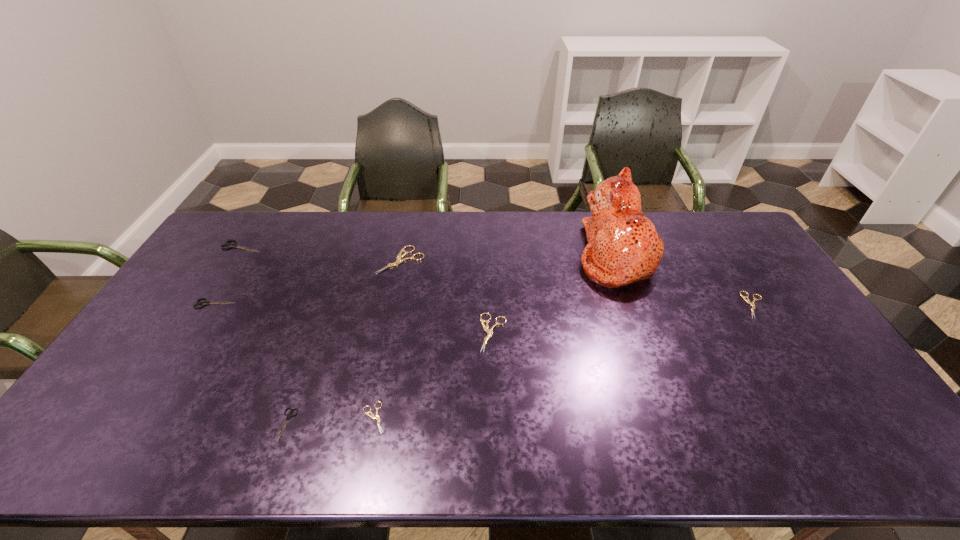
This screenshot has width=960, height=540. I want to click on free space at the near left corner of the desktop, so click(129, 430).

This screenshot has height=540, width=960. What are the coordinates of `free space at the far right corner of the desktop` in the screenshot? It's located at (746, 237).

Locate an element on the screen. The image size is (960, 540). vacant area between the second nearest black shears and the smallest beige shears is located at coordinates (295, 361).

Locate an element on the screen. free space between the tallest object and the fifth shears from right to left is located at coordinates (451, 340).

You are a GUI agent. You are given a task and a screenshot of the screen. Output one action in this format:
    pyautogui.click(x=<x>, y=<y>)
    Task: Click on the free space between the biggest beige shears and the second biggest beige shears
    
    Given the screenshot: What is the action you would take?
    pyautogui.click(x=447, y=296)

Find the location of a particular element. The image size is (960, 540). empty space between the third biggest beige shears and the second shears from right to left is located at coordinates (624, 319).

This screenshot has height=540, width=960. I want to click on vacant space that's between the smallest beige shears and the cat, so click(x=494, y=336).

Image resolution: width=960 pixels, height=540 pixels. Find the location of `vacant space that's between the smallest beige shears and the third object from right to left`. vacant space that's between the smallest beige shears and the third object from right to left is located at coordinates (434, 375).

Image resolution: width=960 pixels, height=540 pixels. What are the coordinates of `free space between the rightmost shears and the sixth shears from left to right` in the screenshot? It's located at (624, 319).

Where is `vacant region between the smallest black shears and the smallest beige shears`? The width and height of the screenshot is (960, 540). vacant region between the smallest black shears and the smallest beige shears is located at coordinates (330, 421).